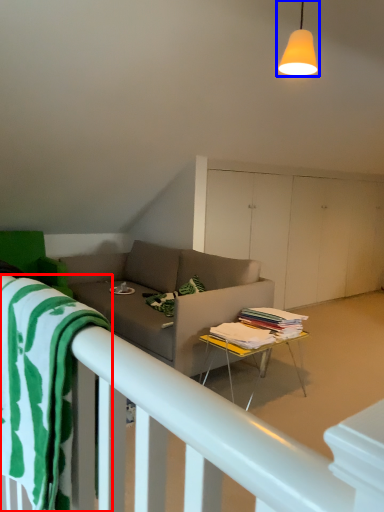
Question: Which point is further to the camera, beach towel (highlighted by a red box) or light fixture (highlighted by a blue box)?

Choices:
 (A) beach towel
 (B) light fixture

Answer: (B)